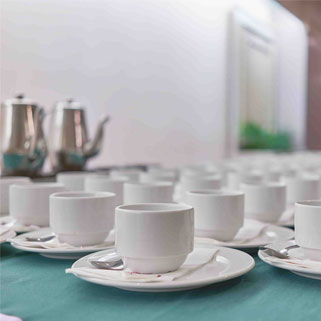
I want to click on wall, so pos(141,70).